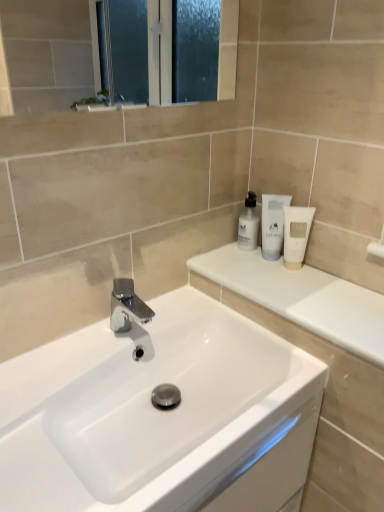
Find the location of `vacant region to the left of white glossy lotion at upper right, which is the 2th toiletry in right-to-left order`. vacant region to the left of white glossy lotion at upper right, which is the 2th toiletry in right-to-left order is located at coordinates (227, 264).